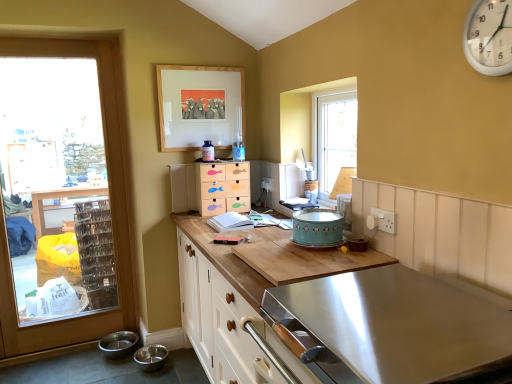
Question: Is white plastic clock at upper right spatially inside wooden fish-themed drawer set at center, or outside of it?

Choices:
 (A) inside
 (B) outside

Answer: (B)

Question: Is point (482, 18) positioned closer to the camera than point (198, 193)?

Choices:
 (A) closer
 (B) farther

Answer: (A)

Question: Which object is the closest to the wooden fish-themed drawer set at center?

Choices:
 (A) wooden cutting board at center, acting as the 2th countertop starting from the bottom
 (B) white plastic clock at upper right
 (C) wooden picture frame at upper center
 (D) wooden door at left
 (E) wooden cutting board at center, acting as the second countertop starting from the top

Answer: (C)

Question: Based on their relative distances, which object is nearer to the teal matte cake stand at center, acting as the second appliance starting from the back?

Choices:
 (A) wooden door at left
 (B) wooden cutting board at center, acting as the second countertop starting from the top
 (C) wooden picture frame at upper center
 (D) white plastic clock at upper right
 (E) wooden fish-themed drawer set at center

Answer: (B)